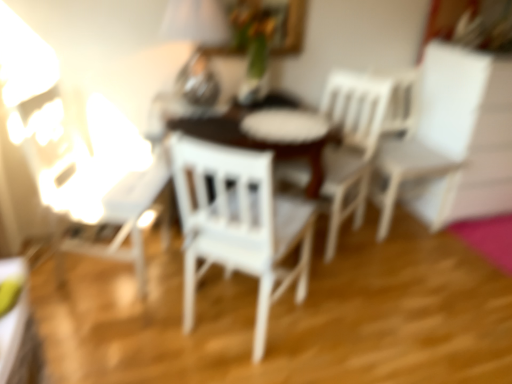
Question: Which direction should I rotate to face white wood chair at center, the 2th chair when ordered from left to right, — up or down?

Choices:
 (A) down
 (B) up

Answer: (B)

Question: From the image's perspective, is metallic silver table lamp at upper center on top of white wood chair at center, positioned as the second chair in right-to-left order?

Choices:
 (A) yes
 (B) no

Answer: (A)

Question: Can you confirm if metallic silver table lamp at upper center is positioned to the left of white wood chair at center, positioned as the second chair in right-to-left order?

Choices:
 (A) no
 (B) yes

Answer: (B)

Question: From the image's perspective, would you say metallic silver table lamp at upper center is shown under white wood chair at center, positioned as the second chair in right-to-left order?

Choices:
 (A) yes
 (B) no

Answer: (B)

Question: Is metallic silver table lamp at upper center to the right of white wood chair at center, positioned as the second chair in right-to-left order, from the viewer's perspective?

Choices:
 (A) no
 (B) yes

Answer: (A)

Question: Can you confirm if metallic silver table lamp at upper center is shorter than white wood chair at center, positioned as the second chair in right-to-left order?

Choices:
 (A) yes
 (B) no

Answer: (A)

Question: Considering the relative sizes of metallic silver table lamp at upper center and white wood chair at center, the 2th chair when ordered from left to right, in the image provided, is metallic silver table lamp at upper center smaller than white wood chair at center, the 2th chair when ordered from left to right,?

Choices:
 (A) no
 (B) yes

Answer: (B)

Question: Considering the relative sizes of white matte chair at right, which appears as the third chair when viewed from the left, and white wood chair at center, which appears as the 1th chair when viewed from the left, in the image provided, is white matte chair at right, which appears as the third chair when viewed from the left, wider than white wood chair at center, which appears as the 1th chair when viewed from the left,?

Choices:
 (A) yes
 (B) no

Answer: (A)

Question: Is white matte chair at right, which appears as the third chair when viewed from the left, bigger than white wood chair at center, which appears as the 1th chair when viewed from the left?

Choices:
 (A) yes
 (B) no

Answer: (A)

Question: Is white matte chair at right, which appears as the third chair when viewed from the left, facing away from white wood chair at center, the 3th chair when ordered from right to left?

Choices:
 (A) no
 (B) yes

Answer: (A)

Question: Is the position of white matte chair at right, which appears as the third chair when viewed from the left, more distant than that of white wood chair at center, which appears as the 1th chair when viewed from the left?

Choices:
 (A) no
 (B) yes

Answer: (B)

Question: Considering the relative sizes of white matte chair at right, which appears as the third chair when viewed from the left, and white wood chair at center, which appears as the 1th chair when viewed from the left, in the image provided, is white matte chair at right, which appears as the third chair when viewed from the left, shorter than white wood chair at center, which appears as the 1th chair when viewed from the left,?

Choices:
 (A) no
 (B) yes

Answer: (A)

Question: Can we say white matte chair at right, which is counted as the first chair, starting from the right, lies outside white wood chair at center, which appears as the 1th chair when viewed from the left?

Choices:
 (A) yes
 (B) no

Answer: (A)

Question: From the image's perspective, is metallic silver table lamp at upper center located above white matte chair at right, which is counted as the first chair, starting from the right?

Choices:
 (A) no
 (B) yes

Answer: (B)